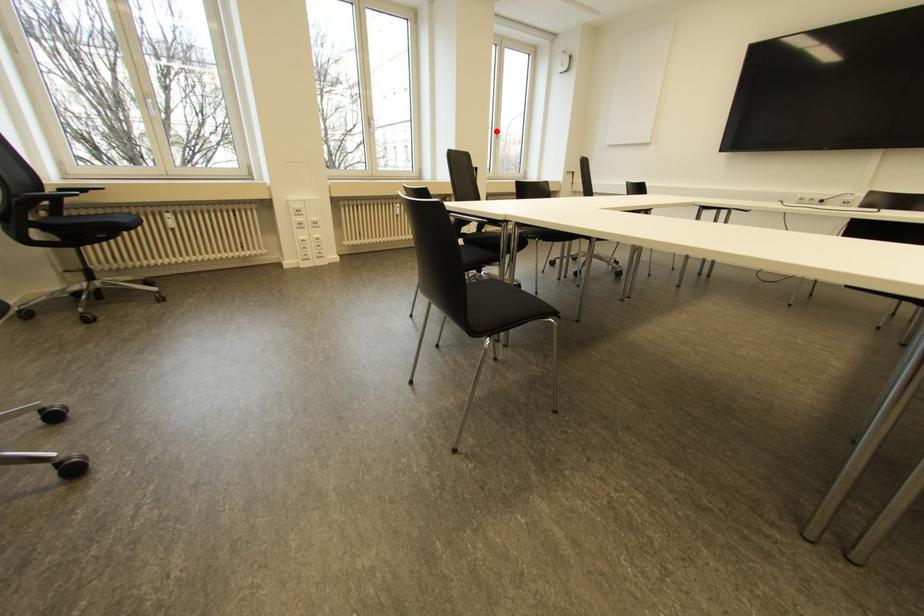
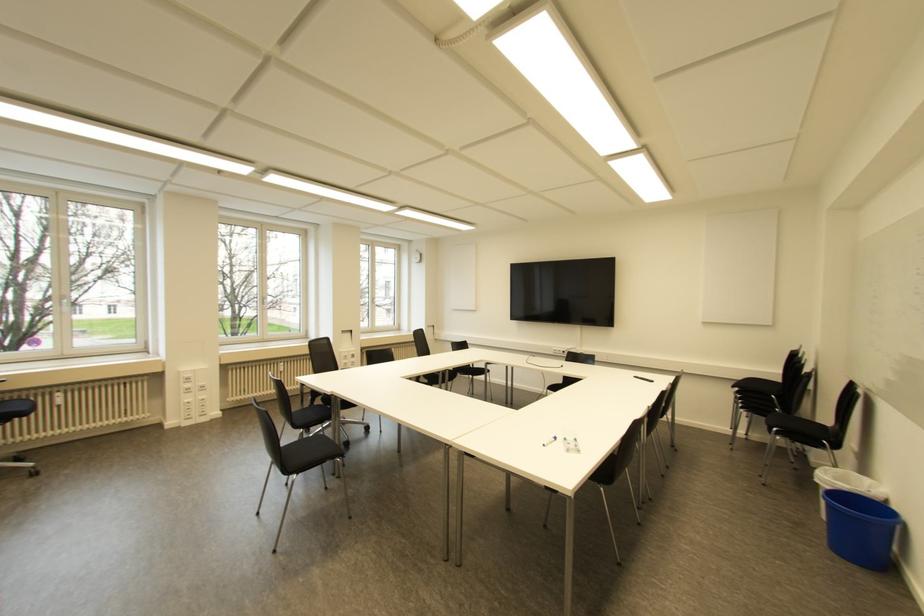
Question: I am providing you with two images of the same scene from different viewpoints. A red point is shown in image1. For the corresponding object point in image2, is it positioned nearer or farther from the camera?

Choices:
 (A) Nearer
 (B) Farther

Answer: (B)